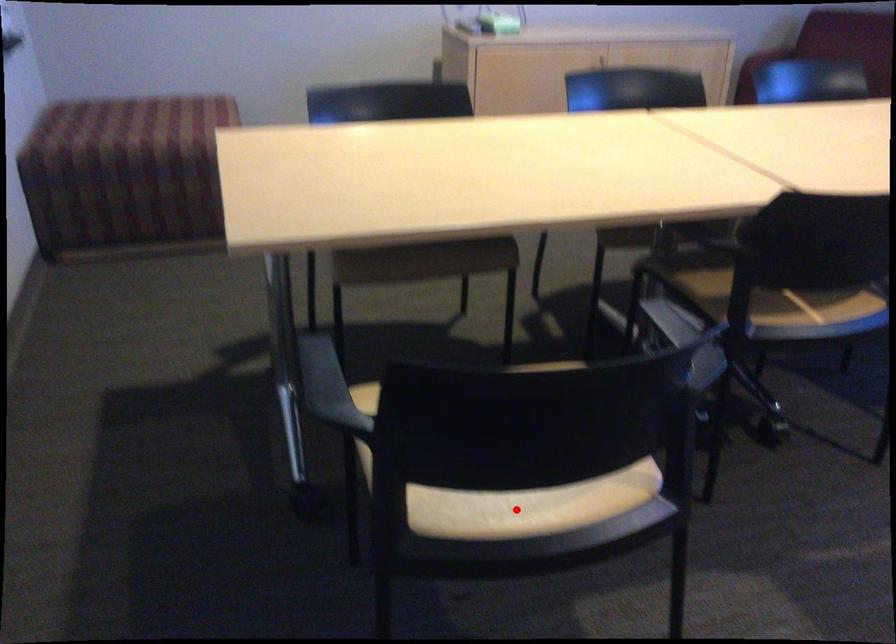
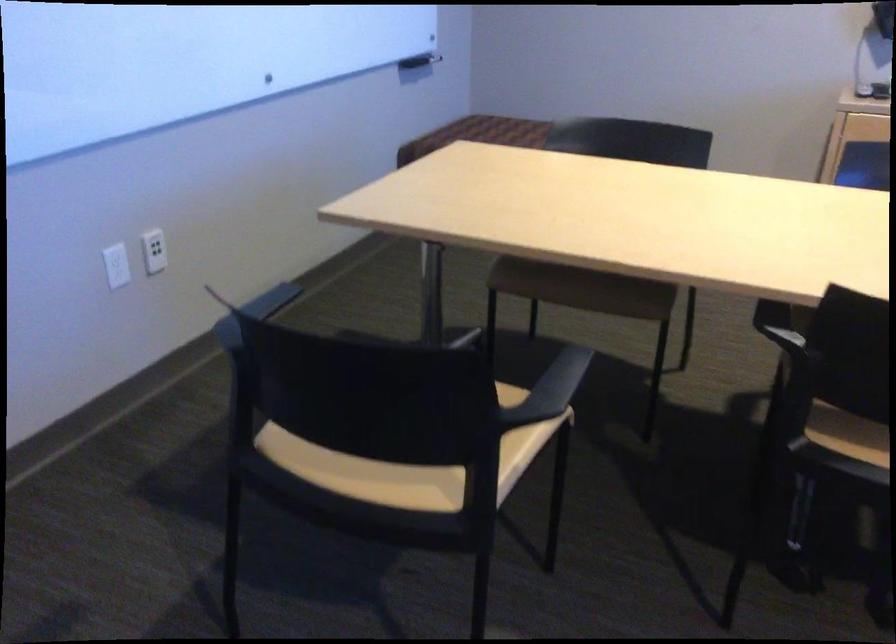
Question: I am providing you with two images of the same scene from different viewpoints. A red point is marked on the first image. Can you still see the location of the red point in image 2?

Choices:
 (A) Yes
 (B) No

Answer: (B)